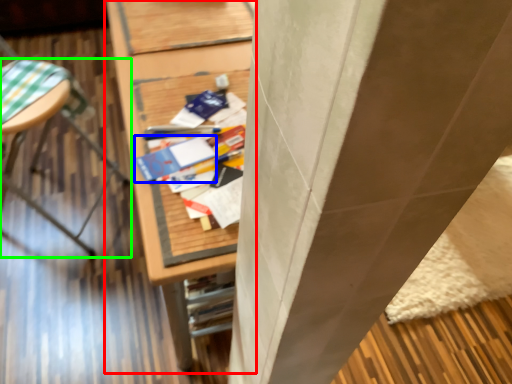
Question: Considering the real-world distances, which object is closest to furniture (highlighted by a red box)? paperback book (highlighted by a blue box) or furniture (highlighted by a green box).

Choices:
 (A) paperback book
 (B) furniture

Answer: (A)